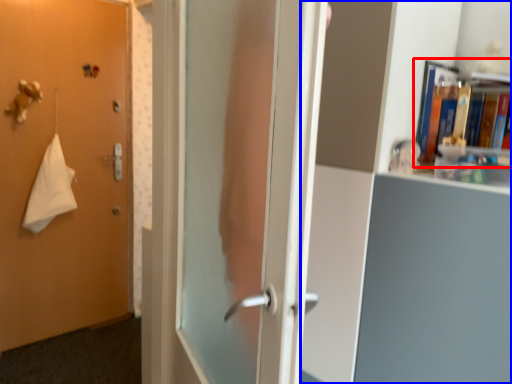
Question: Which point is further to the camera, book (highlighted by a red box) or bookcase (highlighted by a blue box)?

Choices:
 (A) book
 (B) bookcase

Answer: (A)